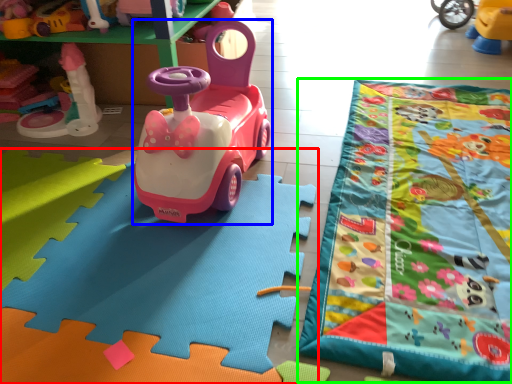
Question: Which is nearer to the toy (highlighted by a red box)? toy car (highlighted by a blue box) or blanket (highlighted by a green box).

Choices:
 (A) toy car
 (B) blanket

Answer: (A)